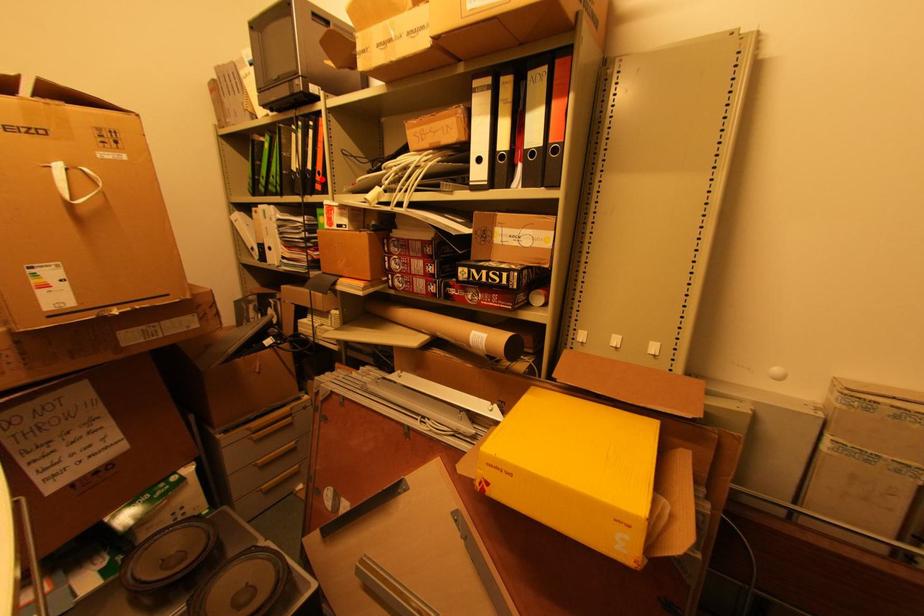
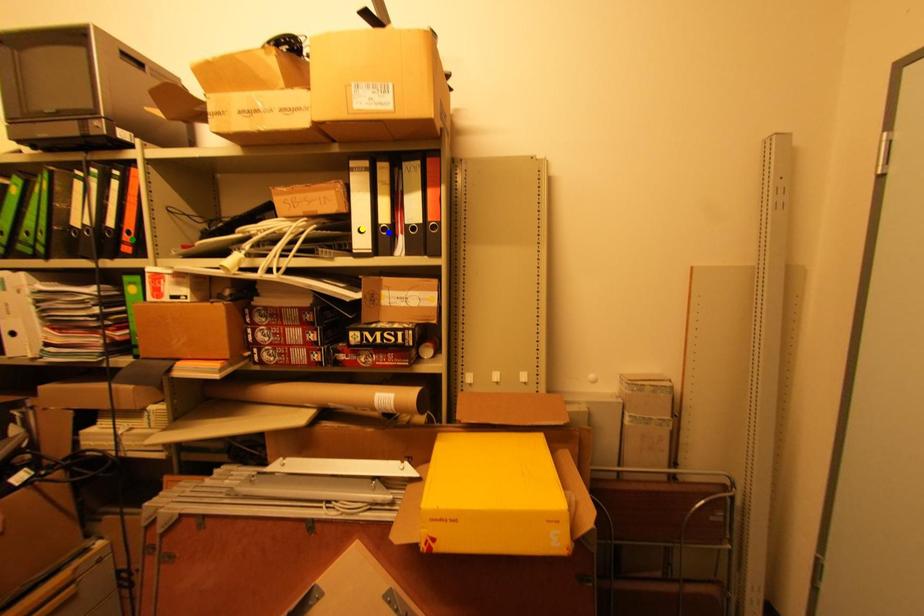
Question: I am providing you with two images of the same scene from different viewpoints. A red point is marked on the first image. You are given multiple points on the second image. Can you choose the point in image 2 that corresponds to the point in image 1?

Choices:
 (A) green point
 (B) yellow point
 (C) blue point

Answer: (A)